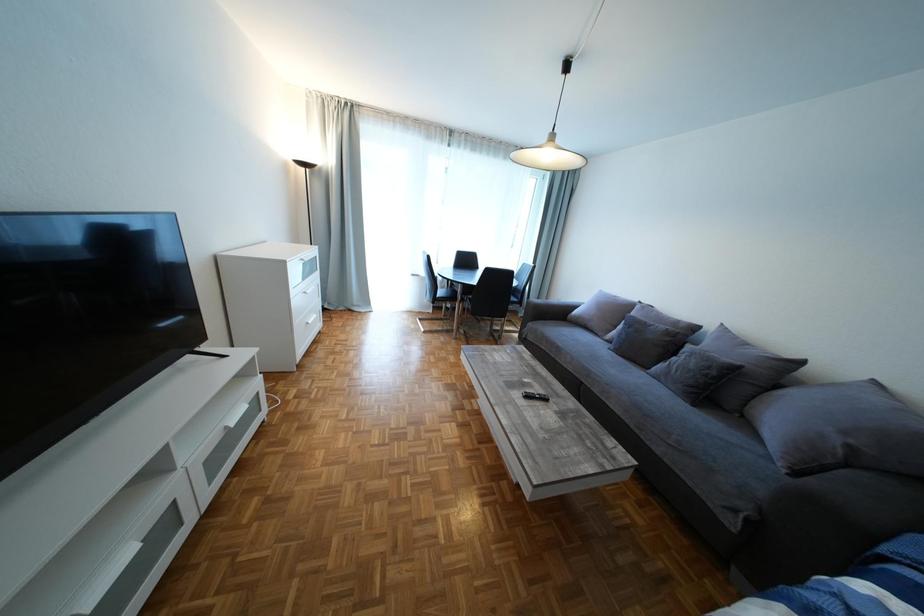
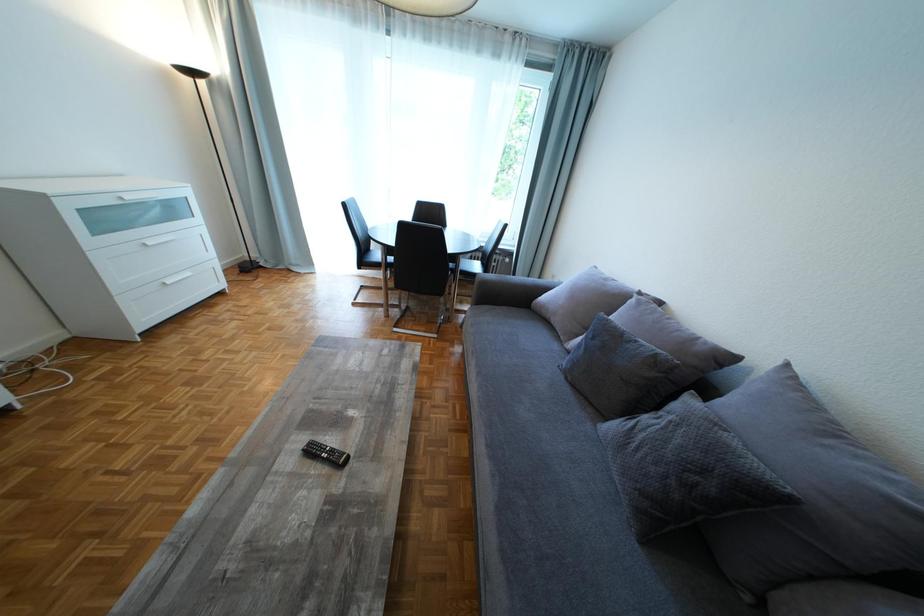
In a continuous first-person perspective shot, in which direction is the camera moving?

The cameraman moved toward right, forward.